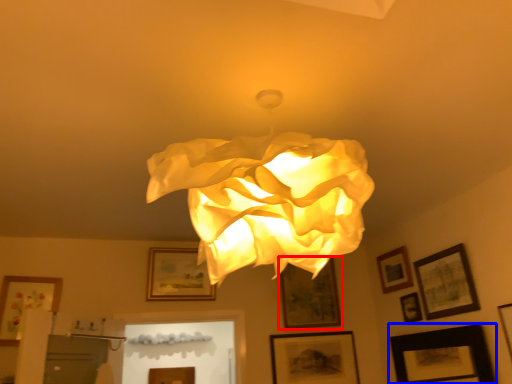
Question: Which object is further to the camera taking this photo, picture frame (highlighted by a red box) or picture frame (highlighted by a blue box)?

Choices:
 (A) picture frame
 (B) picture frame

Answer: (A)